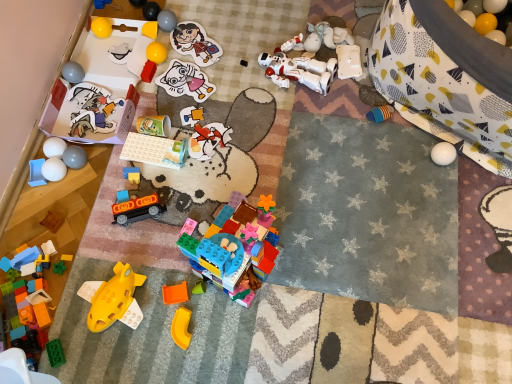
Identify the location of free location in front of matte cardboard cutout at upper left, positioned as the eleventh toy in left-to-right order. This screenshot has width=512, height=384. tap(88, 172).